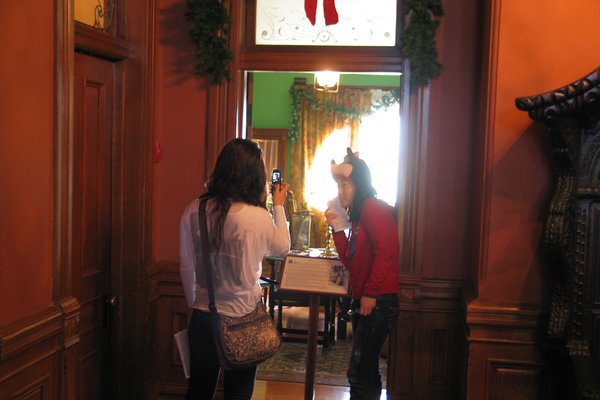
Find the location of a particular element. wooden wall panels is located at coordinates (47, 363), (170, 301), (490, 351), (430, 324).